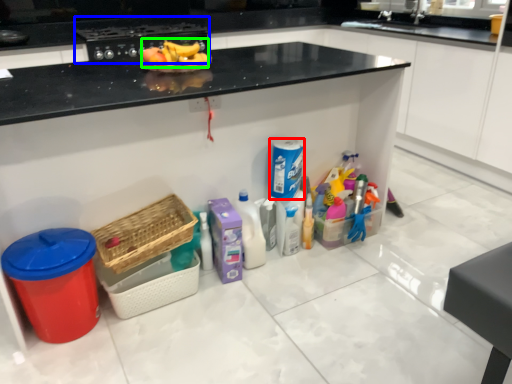
Question: Which is farther away from cleaning product (highlighted by a red box)? appliance (highlighted by a blue box) or fruit (highlighted by a green box)?

Choices:
 (A) appliance
 (B) fruit

Answer: (A)